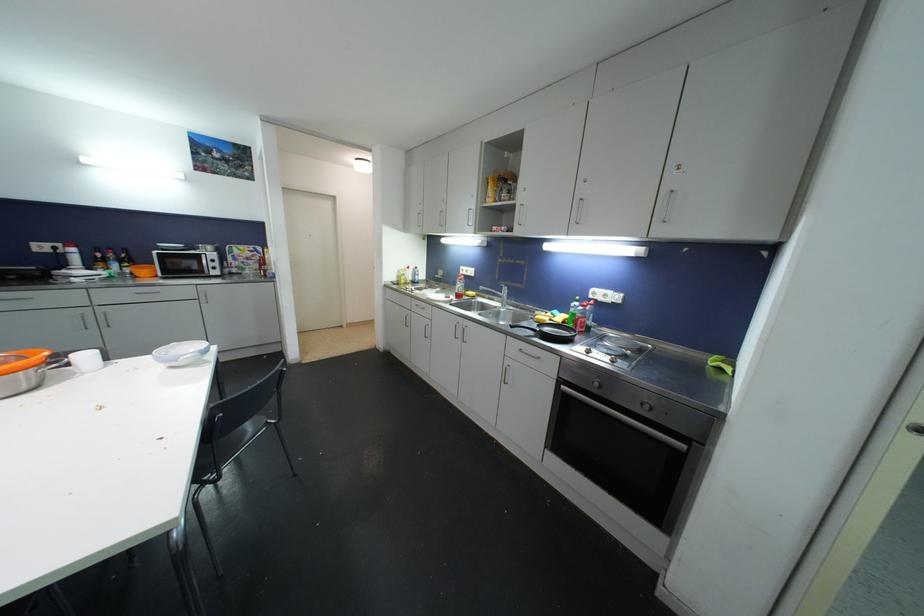
This screenshot has width=924, height=616. What do you see at coordinates (548, 326) in the screenshot?
I see `a black pan handle` at bounding box center [548, 326].